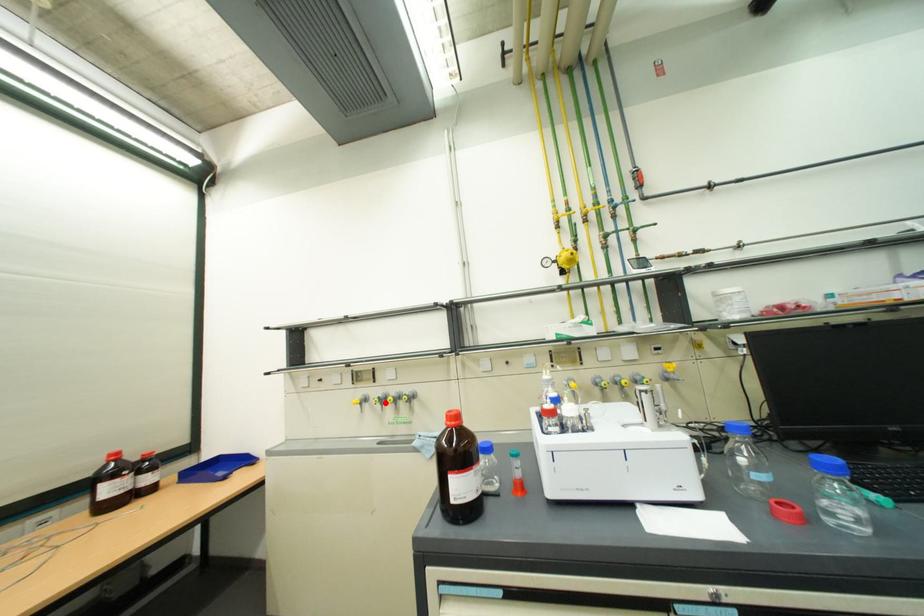
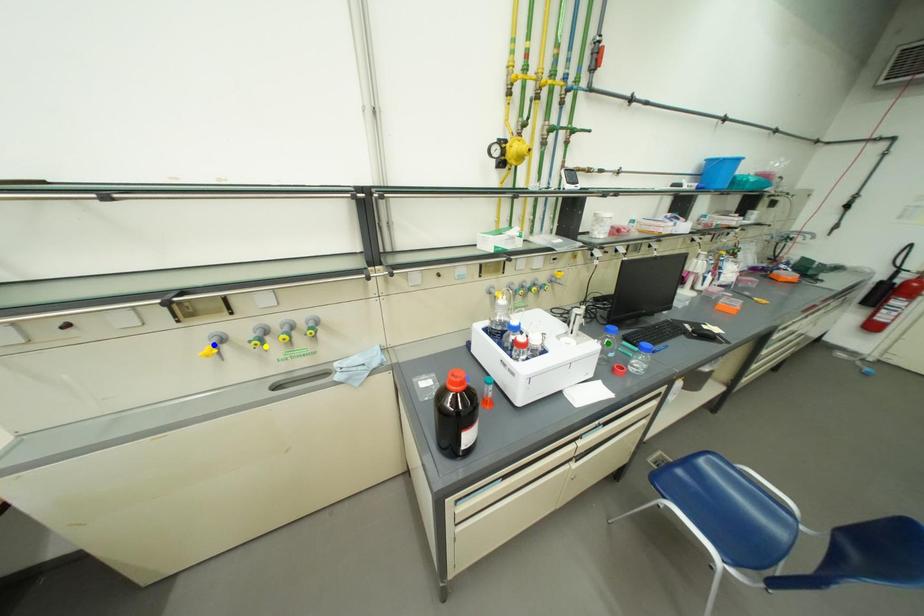
Question: I am providing you with two images of the same scene from different viewpoints. A red point is marked on the first image. You are given multiple points on the second image. Which spot in image 2 lines up with the point in image 1?

Choices:
 (A) yellow point
 (B) green point
 (C) blue point

Answer: (A)